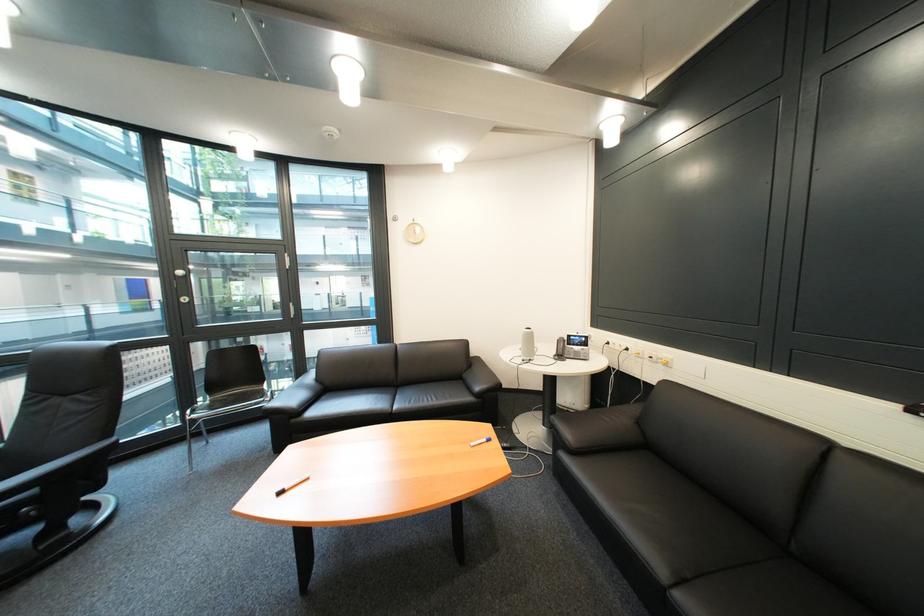
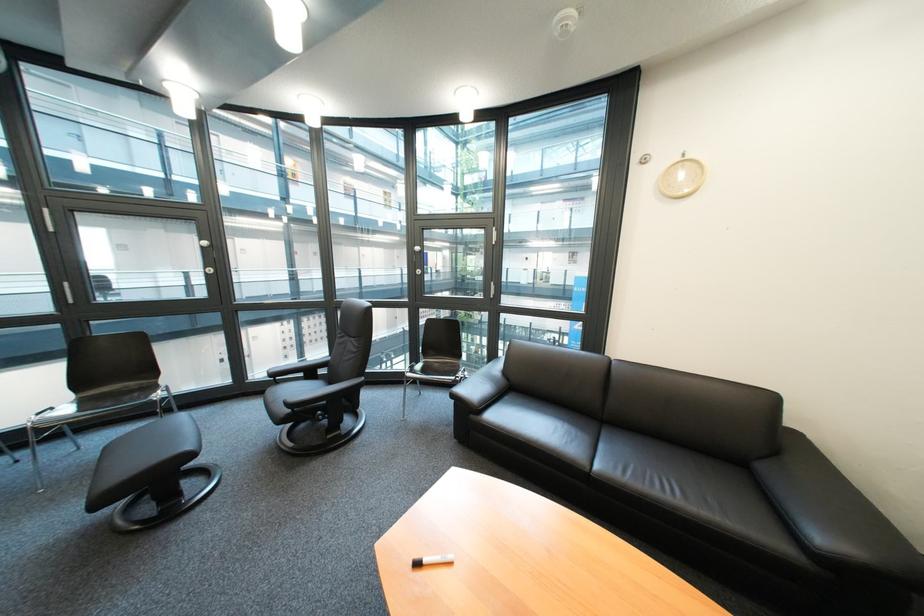
The point at (299, 490) is marked in the first image. Where is the corresponding point in the second image?

(438, 562)